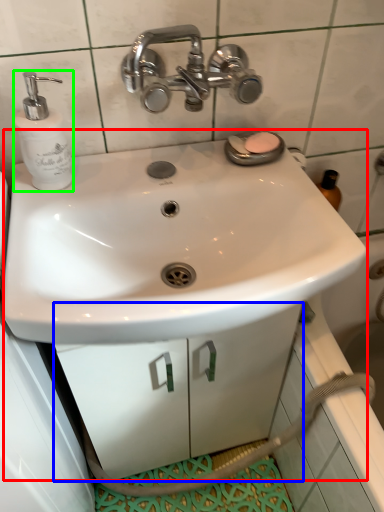
Question: Which is farther away from sink (highlighted by a red box)? drawer (highlighted by a blue box) or soap dispenser (highlighted by a green box)?

Choices:
 (A) drawer
 (B) soap dispenser

Answer: (B)